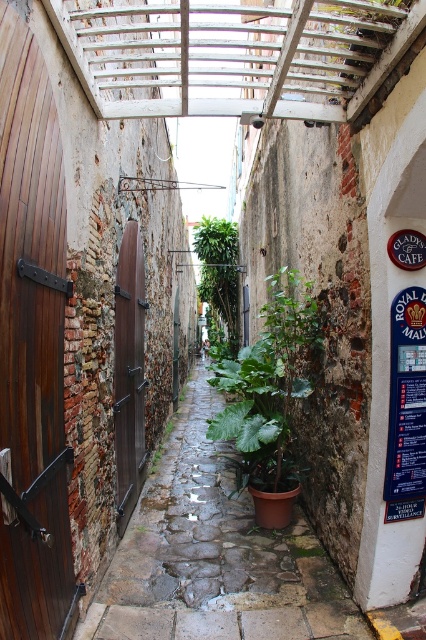
Does green matte leafy plant at center have a smaller size compared to brown wooden door at left?

No.

Is green matte leafy plant at center to the right of brown wooden door at left from the viewer's perspective?

Yes, green matte leafy plant at center is to the right of brown wooden door at left.

Locate an element on the screen. The width and height of the screenshot is (426, 640). green matte leafy plant at center is located at coordinates tap(267, 385).

Where is `green matte leafy plant at center`? green matte leafy plant at center is located at coordinates (267, 385).

Is wooden door at left thinner than brown wooden door at left?

Incorrect, wooden door at left's width is not less than brown wooden door at left's.

What are the coordinates of `wooden door at left` in the screenshot? It's located at (31, 348).

This screenshot has height=640, width=426. Identify the location of wooden door at left. (31, 348).

Who is positioned more to the right, brown stone path at center or green leafy plant at center?

From the viewer's perspective, brown stone path at center appears more on the right side.

Is point (186, 509) positioned in front of point (221, 220)?

Yes.

Describe the element at coordinates (213, 554) in the screenshot. This screenshot has height=640, width=426. I see `brown stone path at center` at that location.

Where is `brown stone path at center`? Image resolution: width=426 pixels, height=640 pixels. brown stone path at center is located at coordinates (213, 554).